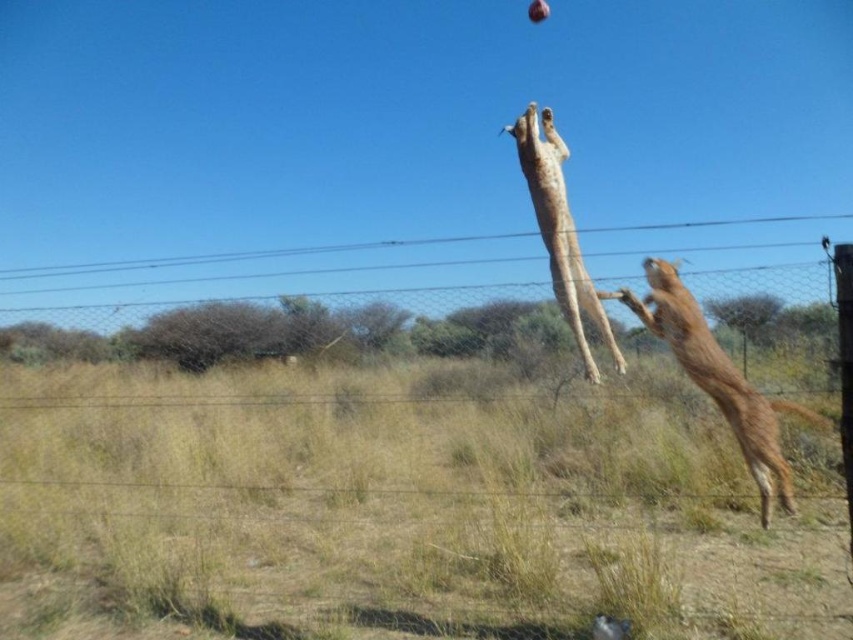
Does wire mesh fence at center appear on the left side of brown furry dog at upper right?

Indeed, wire mesh fence at center is positioned on the left side of brown furry dog at upper right.

Does wire mesh fence at center have a greater width compared to brown furry dog at upper right?

Yes, wire mesh fence at center is wider than brown furry dog at upper right.

Which is in front, point (143, 506) or point (723, 376)?

Point (723, 376)

Image resolution: width=853 pixels, height=640 pixels. I want to click on wire mesh fence at center, so click(410, 497).

In the scene shown: Can you confirm if brown furry dog at upper right is wider than green leafy tree at upper center?

Indeed, brown furry dog at upper right has a greater width compared to green leafy tree at upper center.

Is brown furry dog at upper right above green leafy tree at upper center?

No.

Is point (653, 292) closer to camera compared to point (772, 307)?

No, it is behind (772, 307).

What are the coordinates of `brown furry dog at upper right` in the screenshot? It's located at (717, 378).

Which is below, wire mesh fence at center or golden fur dog at center?

wire mesh fence at center

Measure the distance between point [10,458] and camera.

Point [10,458] is 8.08 meters from camera.

This screenshot has width=853, height=640. What do you see at coordinates (410, 497) in the screenshot? I see `wire mesh fence at center` at bounding box center [410, 497].

Find the location of a particular element. This screenshot has width=853, height=640. wire mesh fence at center is located at coordinates (410, 497).